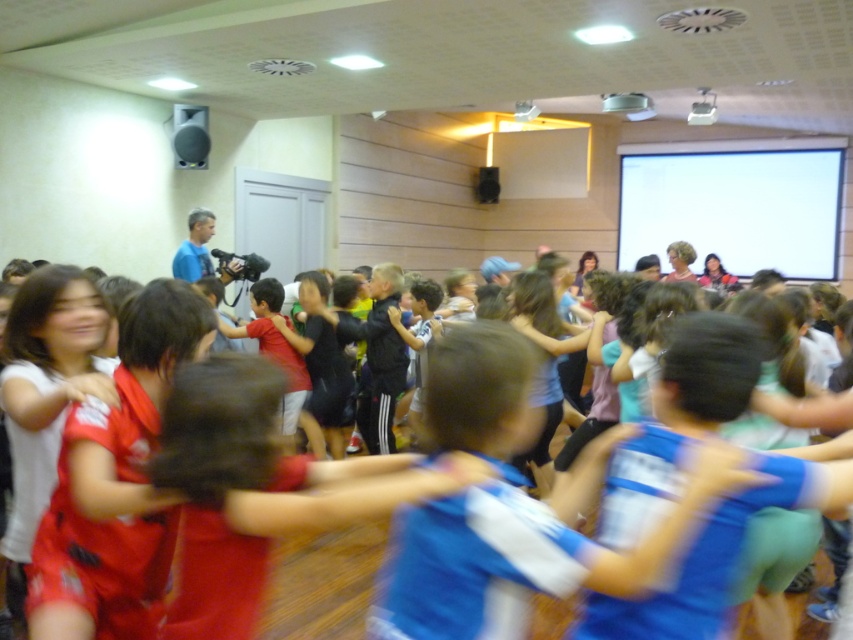
You are a photographer standing at the camera position. You want to take a closeup photo of the blue jersey at center. Can you estimate how far you need to move forward or backward to get the jersey into focus? Assume your camera requires the subject to be exactly 3 feet away for optimal focus.

The blue jersey at center is currently 3.48 feet from the camera. To achieve optimal focus, you need to move backward by approximately 0.48 feet, as the subject must be exactly 3 feet away.